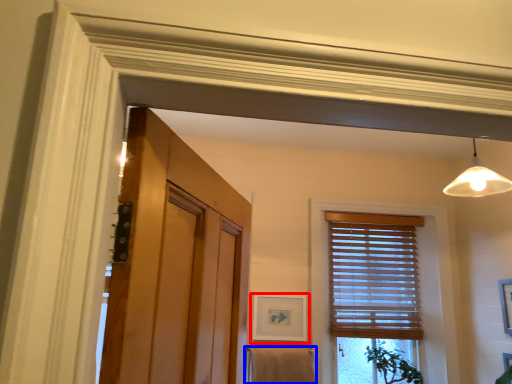
Question: Which object appears closest to the camera in this image, picture frame (highlighted by a red box) or bath towel (highlighted by a blue box)?

Choices:
 (A) picture frame
 (B) bath towel

Answer: (B)